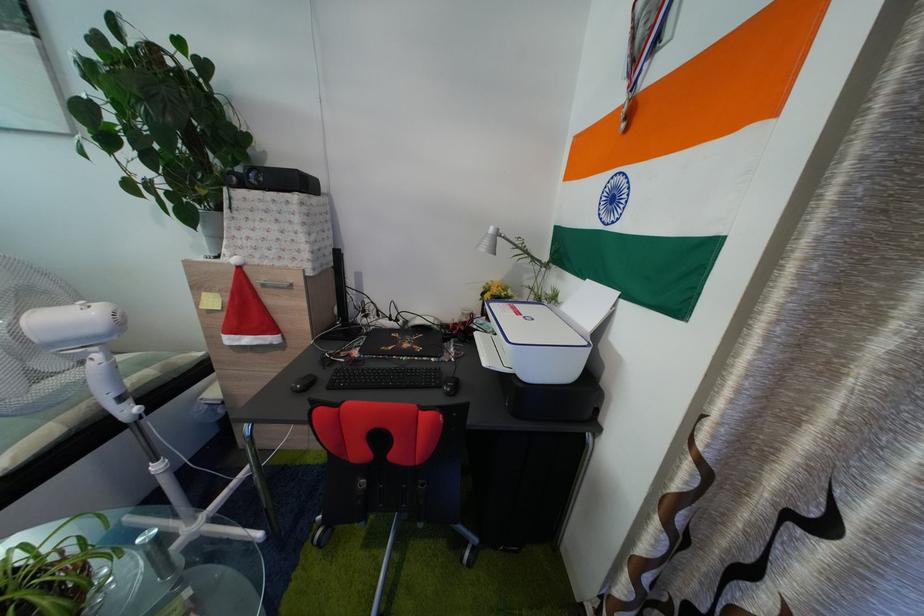
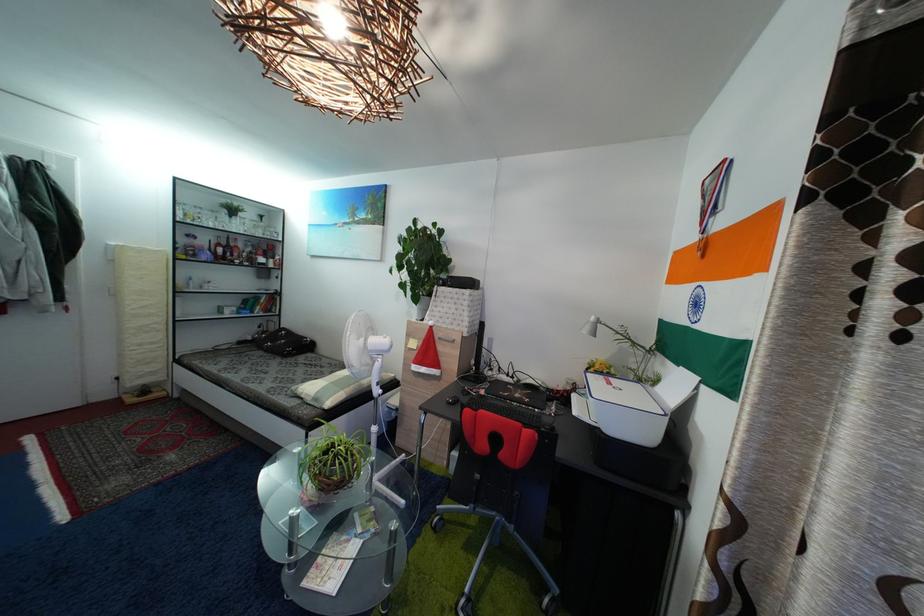
Question: I am providing you with two images of the same scene from different viewpoints. Please identify which objects are invisible in image2.

Choices:
 (A) white lamp head
 (B) patterned white box
 (C) striped pillow
 (D) none of these

Answer: (D)